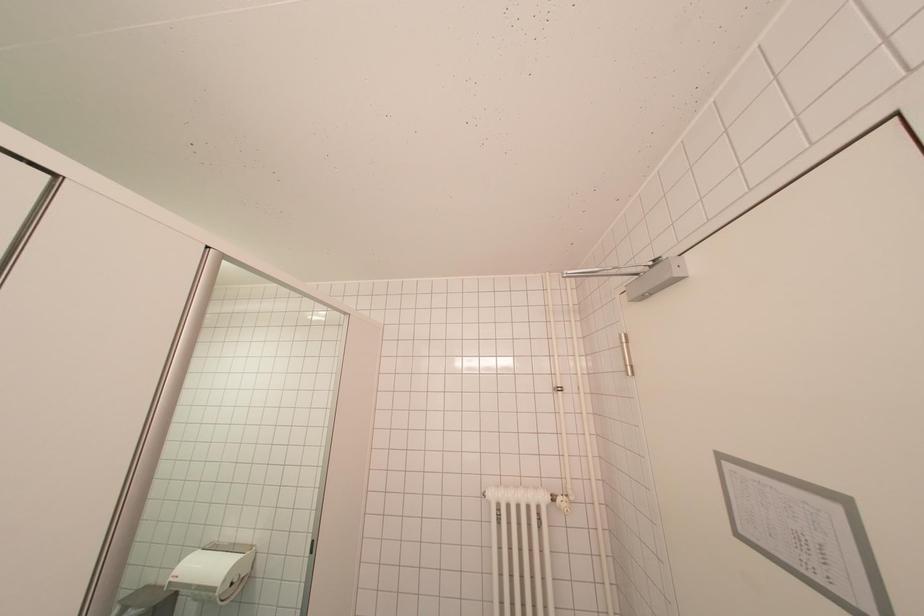
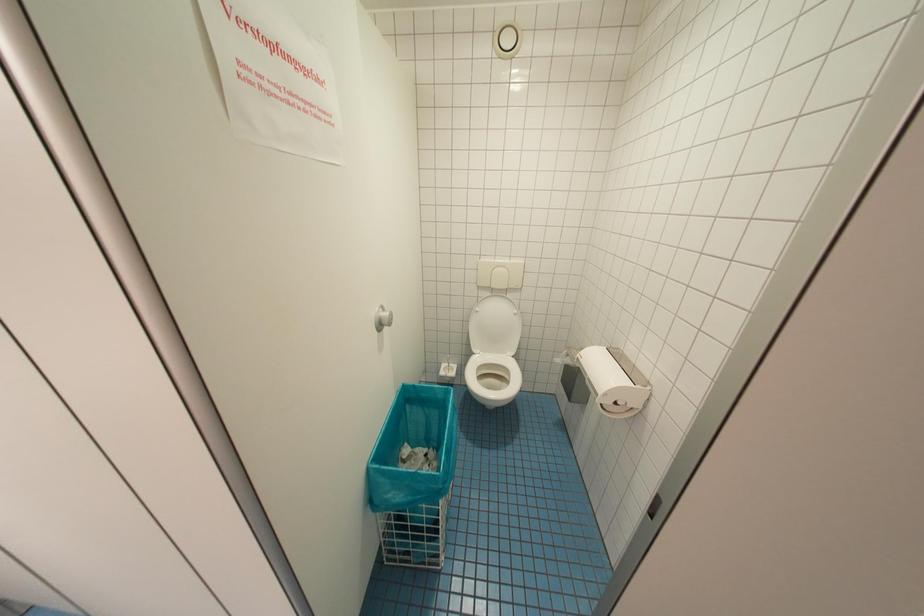
First-person continuous shooting, in which direction is the camera rotating?

The rotation direction of the camera is left-down.